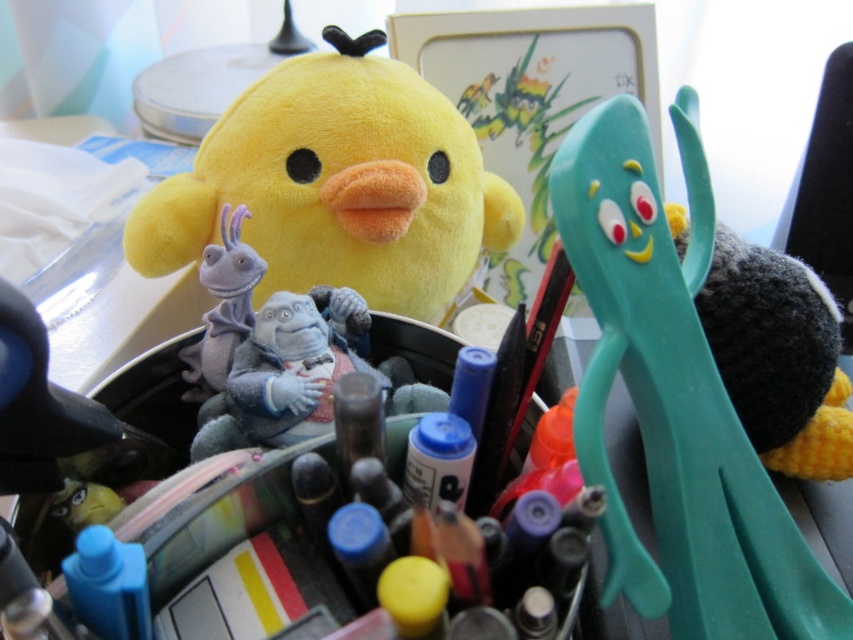
Is soft yellow plush at upper left bigger than fuzzy gray plush at center?

Correct, soft yellow plush at upper left is larger in size than fuzzy gray plush at center.

Does soft yellow plush at upper left have a smaller size compared to fuzzy gray plush at center?

No, soft yellow plush at upper left is not smaller than fuzzy gray plush at center.

This screenshot has width=853, height=640. Identify the location of soft yellow plush at upper left. (337, 184).

Does point (735, 490) come behind point (144, 268)?

No, it is not.

Can you confirm if teal plastic scissors at right is wider than soft yellow plush at upper left?

No, teal plastic scissors at right is not wider than soft yellow plush at upper left.

What do you see at coordinates (675, 400) in the screenshot? I see `teal plastic scissors at right` at bounding box center [675, 400].

Where is `teal plastic scissors at right`? This screenshot has width=853, height=640. teal plastic scissors at right is located at coordinates (x=675, y=400).

Is teal plastic scissors at right smaller than fuzzy gray plush at center?

Actually, teal plastic scissors at right might be larger than fuzzy gray plush at center.

Is point (611, 157) farther from viewer compared to point (395, 360)?

That is False.

What are the coordinates of `teal plastic scissors at right` in the screenshot? It's located at (675, 400).